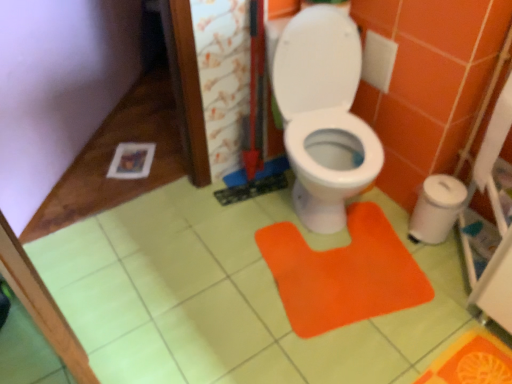
Describe the element at coordinates (436, 208) in the screenshot. I see `white plastic trash can at right` at that location.

Locate an element on the screen. The image size is (512, 384). white paper at right is located at coordinates (494, 137).

From the picture: Are white plastic trash can at right and orange fabric doormat at center far apart?

No, there isn't a large distance between white plastic trash can at right and orange fabric doormat at center.

From their relative heights in the image, would you say white plastic trash can at right is taller or shorter than orange fabric doormat at center?

white plastic trash can at right is taller than orange fabric doormat at center.

From the image's perspective, between white plastic trash can at right and orange fabric doormat at center, which one is located above?

white plastic trash can at right, from the image's perspective.

Considering the sizes of objects white plastic trash can at right and orange fabric doormat at center in the image provided, who is bigger, white plastic trash can at right or orange fabric doormat at center?

Bigger between the two is orange fabric doormat at center.

Is white paper at right to the left or to the right of white plastic trash can at right in the image?

white paper at right is positioned on white plastic trash can at right's right side.

From a real-world perspective, is white paper at right physically located above or below white plastic trash can at right?

From a real-world perspective, white paper at right is physically above white plastic trash can at right.

From the image's perspective, is white paper at right above white plastic trash can at right?

Indeed, from the image's perspective, white paper at right is shown above white plastic trash can at right.

Is orange fabric doormat at center with white plastic trash can at right?

No, orange fabric doormat at center is not touching white plastic trash can at right.

Does orange fabric doormat at center have a greater height compared to white plastic trash can at right?

Incorrect, the height of orange fabric doormat at center is not larger of that of white plastic trash can at right.

From a real-world perspective, who is located lower, orange fabric doormat at center or white plastic trash can at right?

orange fabric doormat at center is physically lower.

Identify the location of potty located on the right of orange fabric doormat at center. (436, 208).

The image size is (512, 384). In order to click on toilet paper lying above the orange fabric doormat at center (from the image's perspective) in this screenshot , I will do (494, 137).

From the image's perspective, is white paper at right located above or below orange fabric doormat at center?

From the image's perspective, white paper at right appears above orange fabric doormat at center.

Is white paper at right positioned before orange fabric doormat at center?

Yes, white paper at right is closer to the camera.

Is white paper at right looking in the opposite direction of orange fabric doormat at center?

No, orange fabric doormat at center is not at the back of white paper at right.

Is white plastic trash can at right completely or partially outside of white paper at right?

white plastic trash can at right lies outside white paper at right's area.

Who is smaller, white plastic trash can at right or white paper at right?

With smaller size is white paper at right.

How far apart are white plastic trash can at right and white paper at right?

white plastic trash can at right and white paper at right are 22.73 centimeters apart from each other.

Can you confirm if white plastic trash can at right is positioned to the left of white paper at right?

Indeed, white plastic trash can at right is positioned on the left side of white paper at right.

Is orange fabric doormat at center far from white paper at right?

They are positioned close to each other.

From the image's perspective, is orange fabric doormat at center above or below white paper at right?

orange fabric doormat at center is situated lower than white paper at right in the image.

Considering the sizes of objects orange fabric doormat at center and white paper at right in the image provided, who is smaller, orange fabric doormat at center or white paper at right?

With smaller size is white paper at right.

Considering the sizes of objects orange fabric doormat at center and white paper at right in the image provided, who is taller, orange fabric doormat at center or white paper at right?

white paper at right is taller.

Find the location of `potty on the right of orange fabric doormat at center`. potty on the right of orange fabric doormat at center is located at coordinates click(436, 208).

Image resolution: width=512 pixels, height=384 pixels. I want to click on toilet paper above the white plastic trash can at right (from the image's perspective), so click(x=494, y=137).

From the image, which object appears to be farther from white paper at right, orange fabric doormat at center or white plastic trash can at right?

Among the two, orange fabric doormat at center is located further to white paper at right.

Estimate the real-world distances between objects in this image. Which object is closer to white paper at right, white plastic trash can at right or orange fabric doormat at center?

Based on the image, white plastic trash can at right appears to be nearer to white paper at right.

Which object lies further to the anchor point orange fabric doormat at center, white plastic trash can at right or white paper at right?

The object further to orange fabric doormat at center is white paper at right.

Which object lies further to the anchor point white plastic trash can at right, white paper at right or orange fabric doormat at center?

Among the two, orange fabric doormat at center is located further to white plastic trash can at right.

When comparing their distances from white plastic trash can at right, does orange fabric doormat at center or white paper at right seem closer?

Based on the image, white paper at right appears to be nearer to white plastic trash can at right.

Considering their positions, is white paper at right positioned further to orange fabric doormat at center than white plastic trash can at right?

white paper at right is positioned further to the anchor orange fabric doormat at center.

Identify the location of potty located between orange fabric doormat at center and white paper at right in the left-right direction. (436, 208).